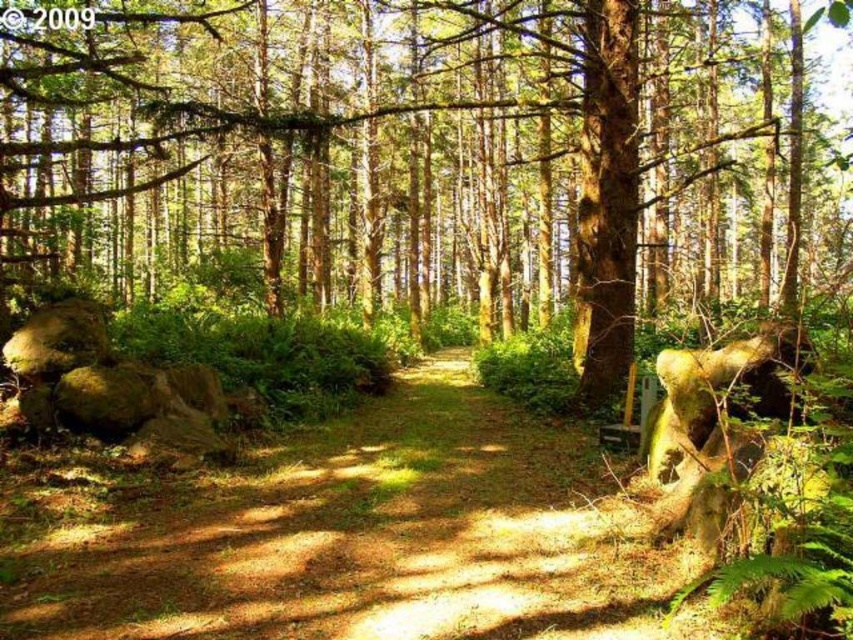
You are a hiker trying to navigate through the forest. You see the green mossy tree at center and the brown dirt path at center. Which one is wider?

The green mossy tree at center is wider than the brown dirt path at center.

You are a hiker trying to follow the brown dirt path at center. You see the green mossy tree at center nearby. Which direction should you turn to stay on the path?

To stay on the brown dirt path at center, you should turn to the left because the green mossy tree at center is located to the right of the path.

You are a hiker standing at the edge of the forest. You see a green mossy tree at center and a brown dirt path at center. Which object is closer to you?

The green mossy tree at center is closer to you because it is in front of the brown dirt path at center.